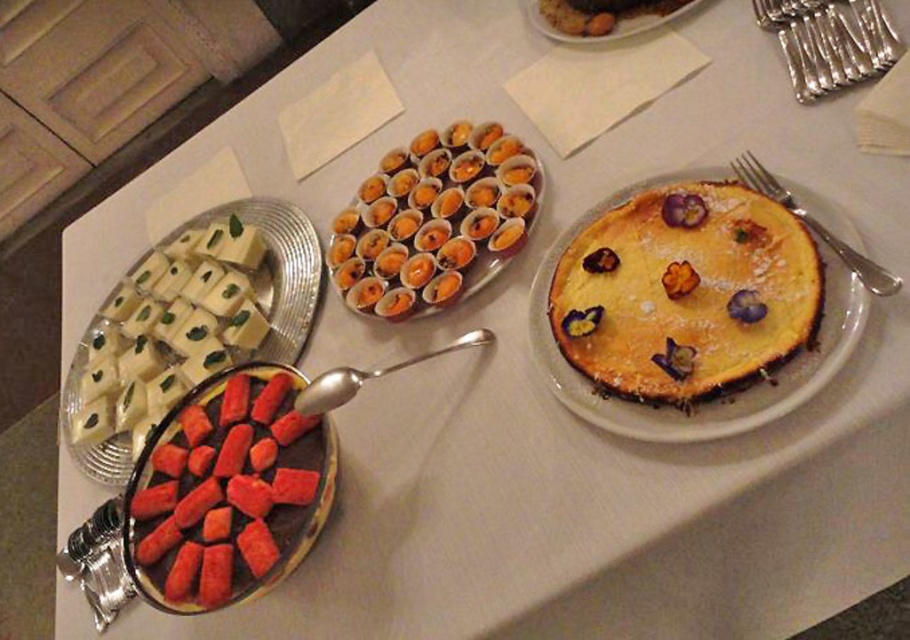
You are a guest at the dessert buffet and want to choose between the two desserts. The silver spoon at center is for the chocolate dessert with red toppings, while the silver fork at right is for the cube dessert with green garnish. Which utensil should you use if you want the chocolate dessert with red toppings?

You should use the silver spoon at center because it is the utensil provided for the chocolate dessert with red toppings, which is located next to the spoon.